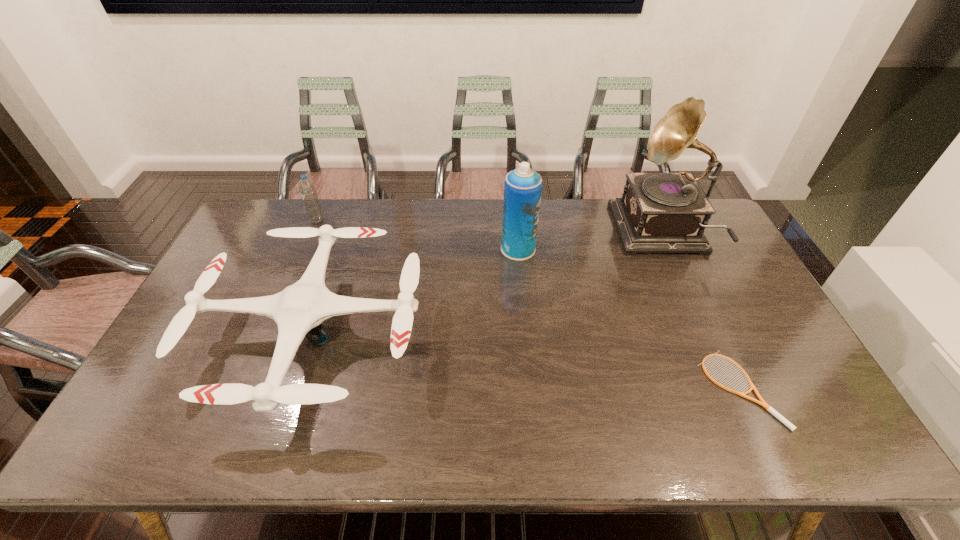
Identify the location of the tallest object. The image size is (960, 540). (659, 212).

The image size is (960, 540). I want to click on the fourth shortest object, so click(x=523, y=186).

Where is `the third object from right to left`? the third object from right to left is located at coordinates (523, 186).

Identify the location of the third tallest object. (307, 188).

At what (x,y) coordinates should I click in order to perform the action: click on drone. Please return your answer as a coordinate pair (x, y). Looking at the image, I should click on (299, 310).

This screenshot has width=960, height=540. What are the coordinates of `the shortest object` in the screenshot? It's located at (762, 403).

In order to click on free space located on the horn of the record player in this screenshot , I will do `click(604, 234)`.

Locate an element on the screen. This screenshot has height=540, width=960. free space located on the horn of the record player is located at coordinates (601, 234).

Image resolution: width=960 pixels, height=540 pixels. What are the coordinates of `free space located 0.360m on the horn of the record player` in the screenshot? It's located at (514, 234).

Find the location of a particular element. Image resolution: width=960 pixels, height=540 pixels. vacant position located on the front of the fourth shortest object is located at coordinates (525, 329).